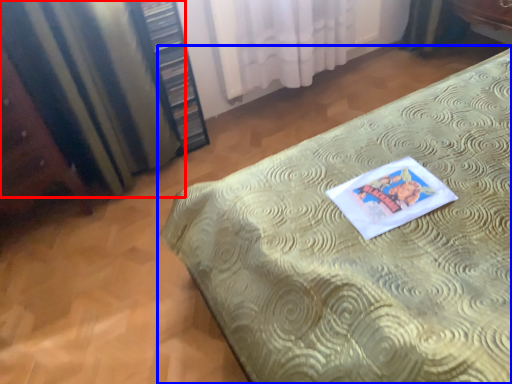
Question: Which object appears closest to the camera in this image, curtain (highlighted by a red box) or bed (highlighted by a blue box)?

Choices:
 (A) curtain
 (B) bed

Answer: (B)